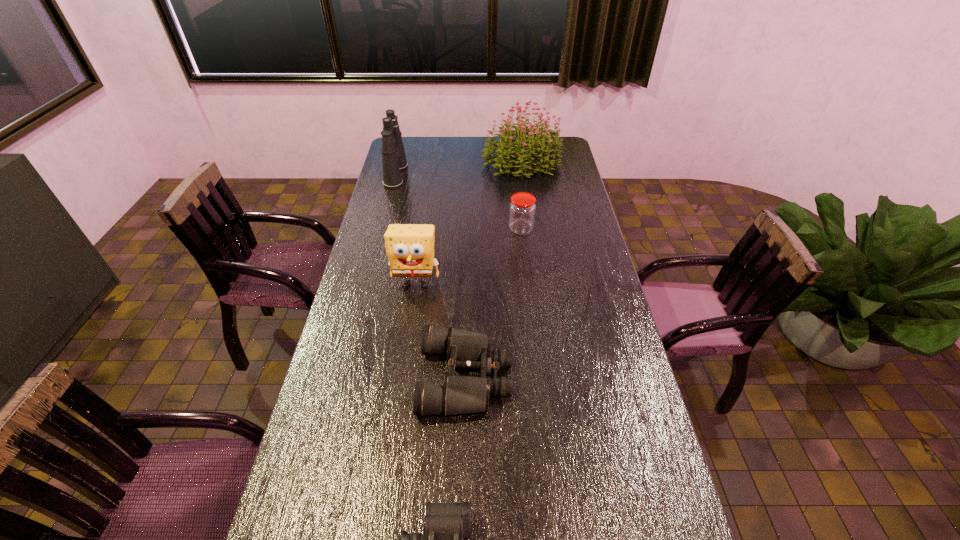
Image resolution: width=960 pixels, height=540 pixels. Identify the location of free space located on the face of the third nearest object. (405, 357).

At what (x,y) coordinates should I click in order to perform the action: click on free space located 0.320m on the left of the jar. Please return your answer as a coordinate pair (x, y). This screenshot has height=540, width=960. Looking at the image, I should click on coord(427,230).

Find the location of `free space located through the eyepieces of the second nearest object`. free space located through the eyepieces of the second nearest object is located at coordinates coord(604,377).

The width and height of the screenshot is (960, 540). In order to click on object that is at the far edge in this screenshot , I will do `click(540, 154)`.

At what (x,y) coordinates should I click in order to perform the action: click on binoculars situated at the left edge. Please return your answer as a coordinate pair (x, y). Looking at the image, I should click on (394, 160).

Locate an element on the screen. The width and height of the screenshot is (960, 540). sponge located at the left edge is located at coordinates (410, 247).

Locate an element on the screen. object at the right edge is located at coordinates tap(540, 154).

Locate an element on the screen. The image size is (960, 540). object that is at the far right corner is located at coordinates point(540,154).

What are the coordinates of `vacant space at the far edge of the desktop` in the screenshot? It's located at (440, 155).

The width and height of the screenshot is (960, 540). In the image, there is a desktop. Identify the location of vacant space at the left edge. (377, 311).